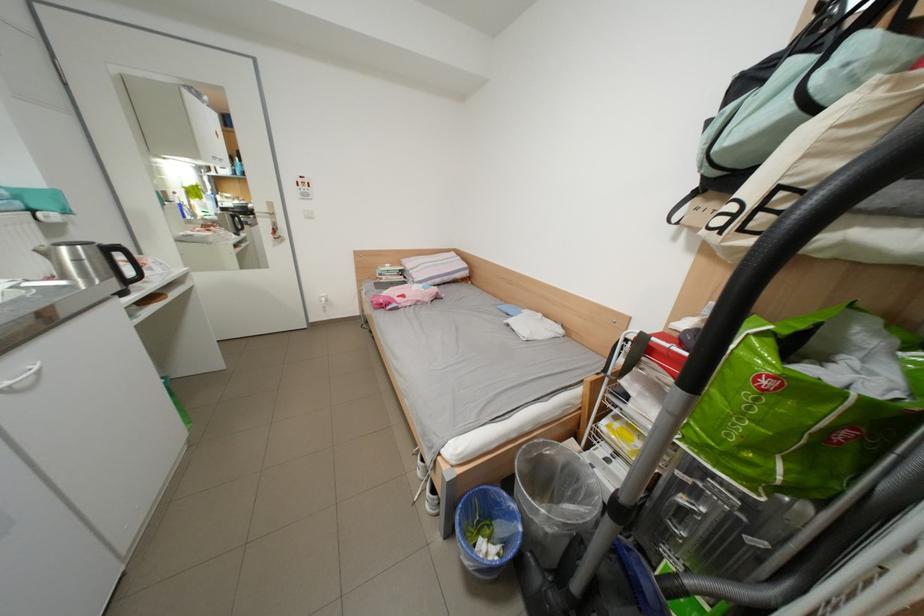
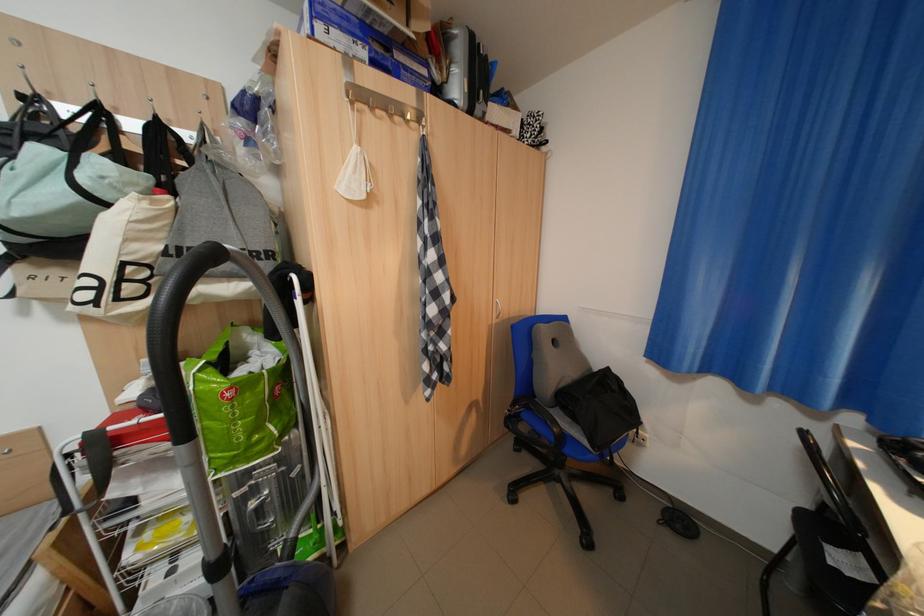
Based on the continuous images, in which direction is the camera rotating?

The camera's rotation is toward right-down.